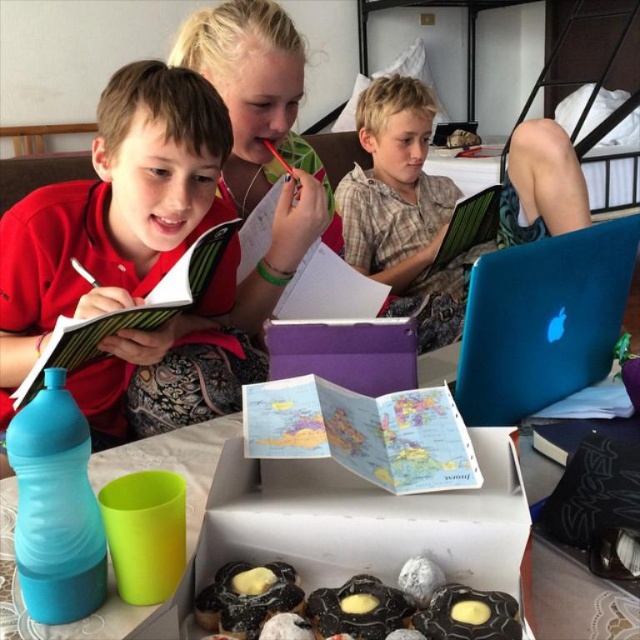
Based on the photo, between wooden bunk bed at upper center and glazed chocolate pastry at center, which one is positioned higher?

Positioned higher is wooden bunk bed at upper center.

Measure the distance from wooden bunk bed at upper center to glazed chocolate pastry at center.

wooden bunk bed at upper center and glazed chocolate pastry at center are 13.35 feet apart from each other.

Find the location of a particular element. This screenshot has height=640, width=640. wooden bunk bed at upper center is located at coordinates (589, 58).

Consider the image. Is matte black notebook at left positioned at the back of chocolate glazed pastry at lower center?

That is True.

Does matte black notebook at left have a lesser width compared to chocolate glazed pastry at lower center?

No, matte black notebook at left is not thinner than chocolate glazed pastry at lower center.

Where is `matte black notebook at left`? Image resolution: width=640 pixels, height=640 pixels. matte black notebook at left is located at coordinates pyautogui.click(x=113, y=211).

Is matte black notebook at left bigger than glazed chocolate pastry at center?

Yes, matte black notebook at left is bigger than glazed chocolate pastry at center.

Does matte black notebook at left have a lesser height compared to glazed chocolate pastry at center?

Incorrect, matte black notebook at left's height does not fall short of glazed chocolate pastry at center's.

Who is more forward, [106,230] or [490,627]?

Point [490,627] is in front.

What are the coordinates of `matte black notebook at left` in the screenshot? It's located at (113, 211).